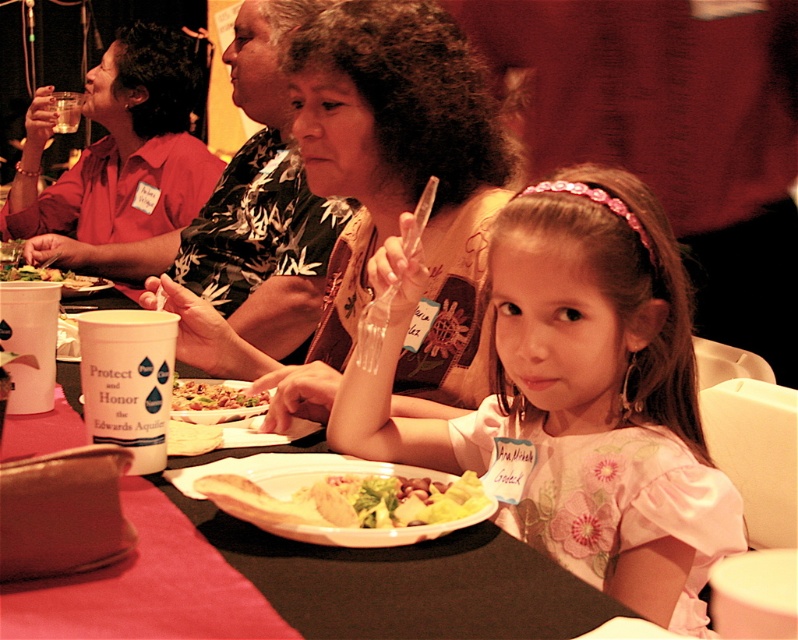
You are a photographer taking a picture of the pink floral dress at center and the yellowish matte salad at center. Which object is closer to the camera?

The pink floral dress at center is closer to the camera because it is located above the yellowish matte salad at center, which is further away.

You are a photographer at the event and need to adjust the lighting so that both the matte red shirt at upper left and the yellowish matte plate at center are well lit. Which object is closer to the camera, and thus requires more direct lighting?

The matte red shirt at upper left is closer to the camera than the yellowish matte plate at center, so it requires more direct lighting to ensure it is well lit.